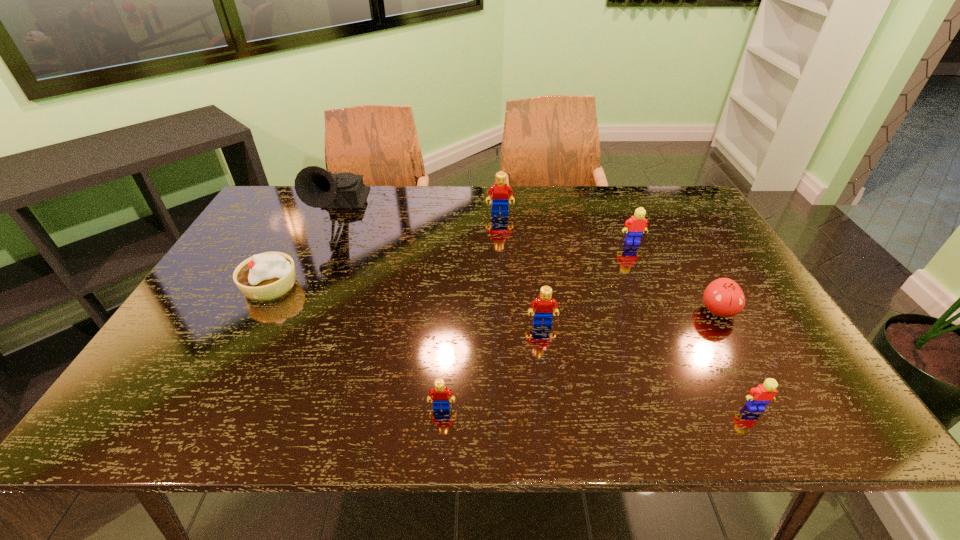
The image size is (960, 540). What are the coordinates of `phonograph_record positioned at the far edge` in the screenshot? It's located at (316, 187).

Locate an element on the screen. Lego that is at the far edge is located at coordinates (499, 191).

This screenshot has height=540, width=960. Identify the location of object that is at the left edge. (266, 276).

I want to click on apple at the right edge, so click(723, 297).

In order to click on Lego that is at the right edge in this screenshot , I will do `click(758, 397)`.

You are a GUI agent. You are given a task and a screenshot of the screen. Output one action in this format:
    pyautogui.click(x=<x>, y=<y>)
    Task: Click on the object at the near right corner
    
    Given the screenshot: What is the action you would take?
    pyautogui.click(x=758, y=397)

In the image, there is a desktop. Identify the location of free space at the far edge. (313, 213).

Where is `vacant space at the left edge of the desktop`? vacant space at the left edge of the desktop is located at coordinates pyautogui.click(x=185, y=340).

Locate an element on the screen. This screenshot has height=540, width=960. vacant point at the right edge is located at coordinates (726, 270).

Identify the location of vacant area at the far left corner. (298, 200).